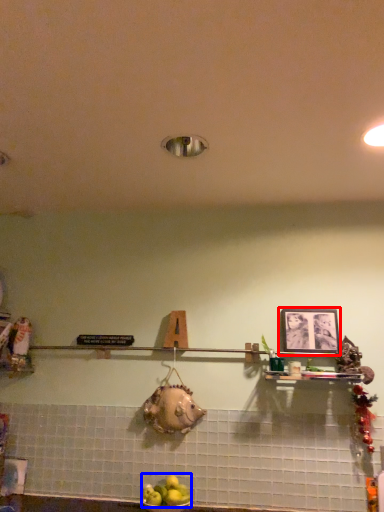
Question: Which of the following is the farthest to the observer, picture frame (highlighted by a red box) or apple (highlighted by a blue box)?

Choices:
 (A) picture frame
 (B) apple

Answer: (A)